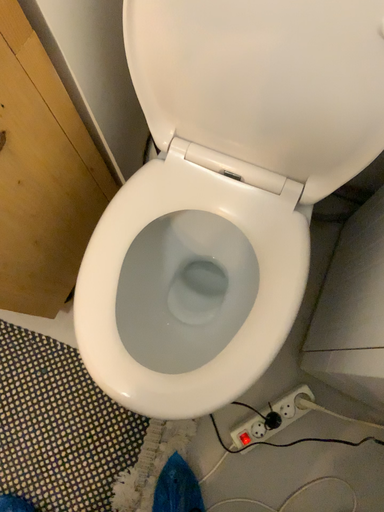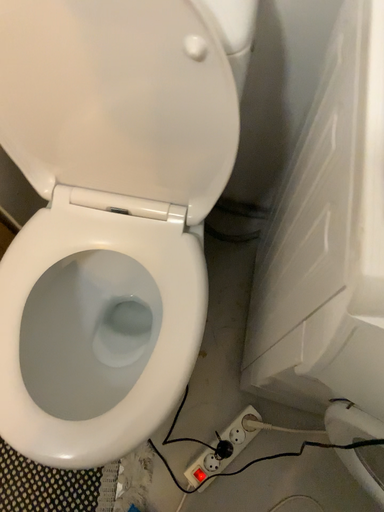
Question: Which way did the camera rotate in the video?

Choices:
 (A) rotated upward
 (B) rotated downward

Answer: (A)